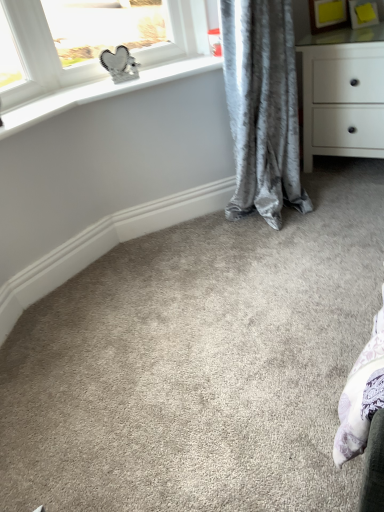
Question: Is white matte chest of drawers at upper right at the right side of velvet gray curtain at center?

Choices:
 (A) no
 (B) yes

Answer: (B)

Question: Is white matte chest of drawers at upper right positioned before velvet gray curtain at center?

Choices:
 (A) no
 (B) yes

Answer: (A)

Question: From a real-world perspective, is white matte chest of drawers at upper right physically above velvet gray curtain at center?

Choices:
 (A) no
 (B) yes

Answer: (A)

Question: Can you confirm if white matte chest of drawers at upper right is thinner than velvet gray curtain at center?

Choices:
 (A) yes
 (B) no

Answer: (B)

Question: Is white matte chest of drawers at upper right far from velvet gray curtain at center?

Choices:
 (A) no
 (B) yes

Answer: (A)

Question: Is white matte chest of drawers at upper right smaller than velvet gray curtain at center?

Choices:
 (A) yes
 (B) no

Answer: (A)

Question: Is velvet gray curtain at center thinner than white matte chest of drawers at upper right?

Choices:
 (A) no
 (B) yes

Answer: (B)

Question: Does velvet gray curtain at center have a smaller size compared to white matte chest of drawers at upper right?

Choices:
 (A) yes
 (B) no

Answer: (B)

Question: Is white matte chest of drawers at upper right at the back of velvet gray curtain at center?

Choices:
 (A) no
 (B) yes

Answer: (A)

Question: Is velvet gray curtain at center closer to the viewer compared to white matte chest of drawers at upper right?

Choices:
 (A) no
 (B) yes

Answer: (B)

Question: Could white matte chest of drawers at upper right be considered to be inside velvet gray curtain at center?

Choices:
 (A) yes
 (B) no

Answer: (B)

Question: Is velvet gray curtain at center not close to white matte chest of drawers at upper right?

Choices:
 (A) yes
 (B) no

Answer: (B)

Question: Visually, is white matte chest of drawers at upper right positioned to the left or to the right of velvet gray curtain at center?

Choices:
 (A) right
 (B) left

Answer: (A)